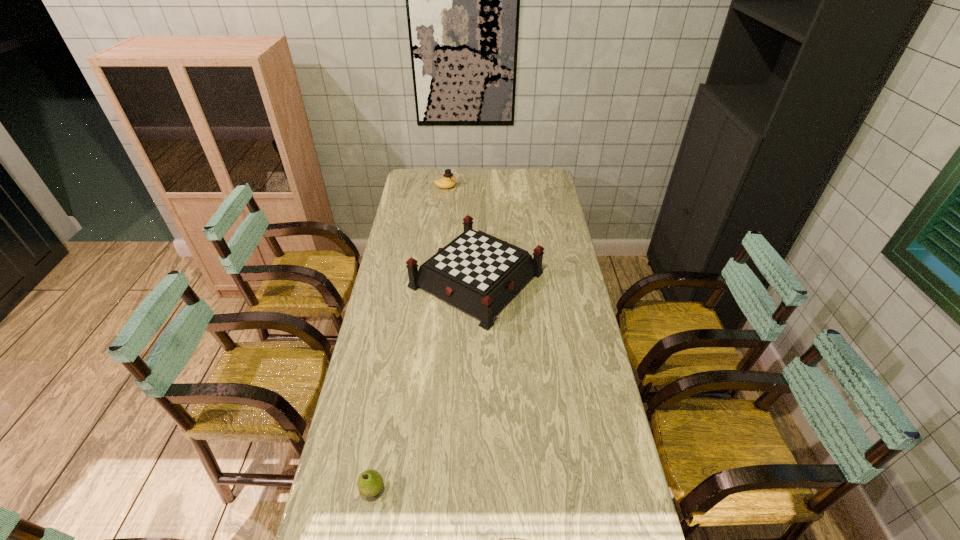
The height and width of the screenshot is (540, 960). Find the location of `pear at the left edge`. pear at the left edge is located at coordinates (370, 482).

Locate an element on the screen. object at the right edge is located at coordinates (478, 273).

Locate an element on the screen. Image resolution: width=960 pixels, height=540 pixels. object located at the far left corner is located at coordinates (448, 181).

You are a GUI agent. You are given a task and a screenshot of the screen. Output one action in this format:
    pyautogui.click(x=<x>, y=<y>)
    Task: Click on the vacant region at the far edge of the desktop
    This screenshot has height=540, width=960.
    Given the screenshot: What is the action you would take?
    pyautogui.click(x=436, y=184)

The height and width of the screenshot is (540, 960). In the image, there is a desktop. Identify the location of blank space at the left edge. (359, 406).

You are a GUI agent. You are given a task and a screenshot of the screen. Output one action in this format:
    pyautogui.click(x=<x>, y=<y>)
    Task: Click on the vacant space at the right edge of the desktop
    The image size is (960, 540).
    Given the screenshot: What is the action you would take?
    pyautogui.click(x=558, y=303)

Locate an element on the screen. The width and height of the screenshot is (960, 540). vacant space at the far right corner of the desktop is located at coordinates (536, 169).

Locate an element on the screen. The height and width of the screenshot is (540, 960). vacant space that's between the nearest object and the duck is located at coordinates (409, 338).

You are a GUI agent. You are given a task and a screenshot of the screen. Output one action in this format:
    pyautogui.click(x=<x>, y=<y>)
    Task: Click on the free spot between the nearest object and the second nearest object
    
    Given the screenshot: What is the action you would take?
    pyautogui.click(x=424, y=384)

Locate an element on the screen. This screenshot has width=960, height=540. empty space between the duck and the pear is located at coordinates (409, 338).